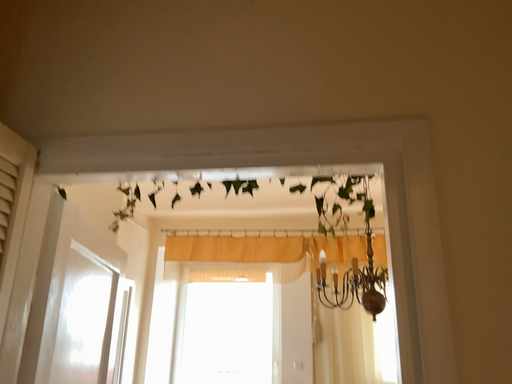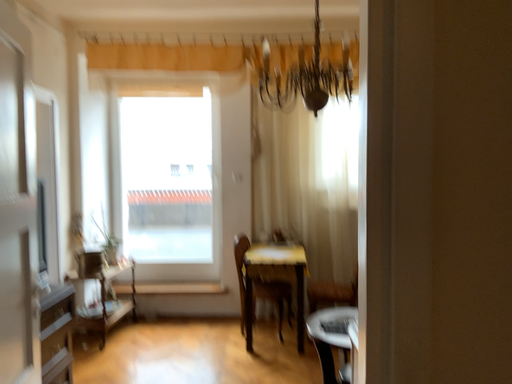
Question: Which way did the camera rotate in the video?

Choices:
 (A) rotated left
 (B) rotated right

Answer: (B)